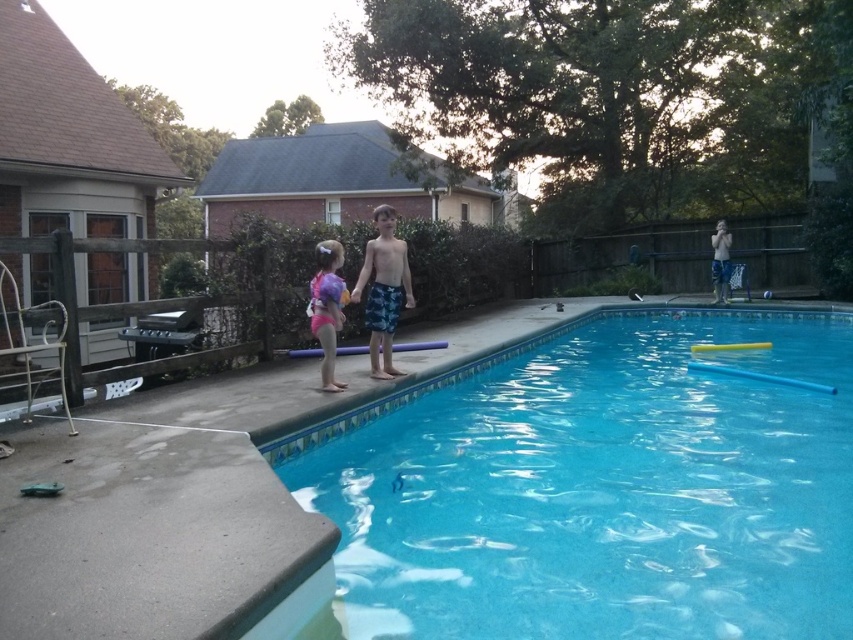
You are standing at the edge of the pool in the backyard scene. There are two points marked in the image. Which point, point 1 at coordinates (405, 260) or point 2 at coordinates (724, 221), is closer to you?

Point 1 at coordinates (405, 260) is closer to the viewer than point 2 at coordinates (724, 221).

You are a lifeguard observing the pool area and notice two children wearing blue shorts. The first child has blue printed shorts at center and the second has blue textured shorts at upper right. Which child has shorter shorts?

The blue printed shorts at center is shorter than blue textured shorts at upper right, so the first child has shorter shorts.

You are a parent supervising the children in the backyard. You notice the clear blue water at center and the blue printed shorts at center. Which object is positioned lower in the scene?

The clear blue water at center is located below blue printed shorts at center, so the clear blue water at center is positioned lower in the scene.